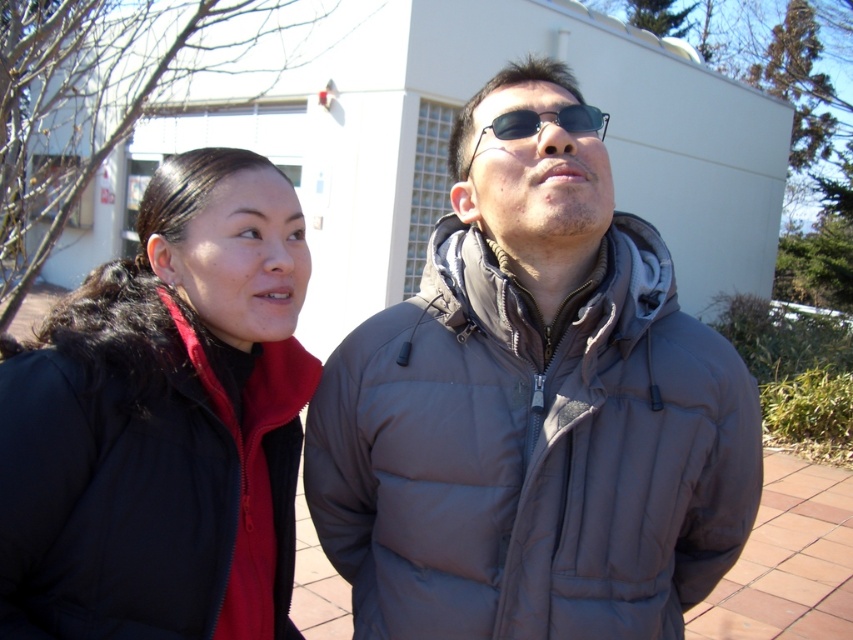
What do you see at coordinates (149, 444) in the screenshot?
I see `black matte jacket at left` at bounding box center [149, 444].

Does black matte jacket at left have a larger size compared to black plastic sunglasses at center?

Correct, black matte jacket at left is larger in size than black plastic sunglasses at center.

The width and height of the screenshot is (853, 640). I want to click on black matte jacket at left, so click(149, 444).

Between gray puffy jacket at center and black plastic sunglasses at center, which one appears on the left side from the viewer's perspective?

gray puffy jacket at center is more to the left.

What do you see at coordinates (532, 412) in the screenshot? I see `gray puffy jacket at center` at bounding box center [532, 412].

Which is behind, point (463, 580) or point (525, 136)?

Point (525, 136)

Locate an element on the screen. gray puffy jacket at center is located at coordinates (532, 412).

Is point (503, 154) positioned before point (163, 582)?

That is False.

Between gray puffy jacket at center and black matte jacket at left, which one appears on the right side from the viewer's perspective?

Positioned to the right is gray puffy jacket at center.

At what (x,y) coordinates should I click in order to perform the action: click on gray puffy jacket at center. Please return your answer as a coordinate pair (x, y). Looking at the image, I should click on (532, 412).

Image resolution: width=853 pixels, height=640 pixels. I want to click on gray puffy jacket at center, so click(x=532, y=412).